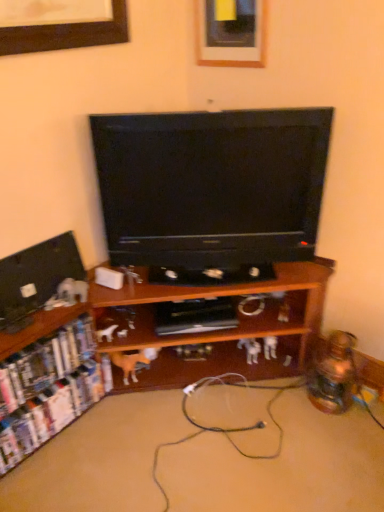
Identify the location of vacant location below black glossy television at center (from a real-world perspective). This screenshot has width=384, height=512. (212, 275).